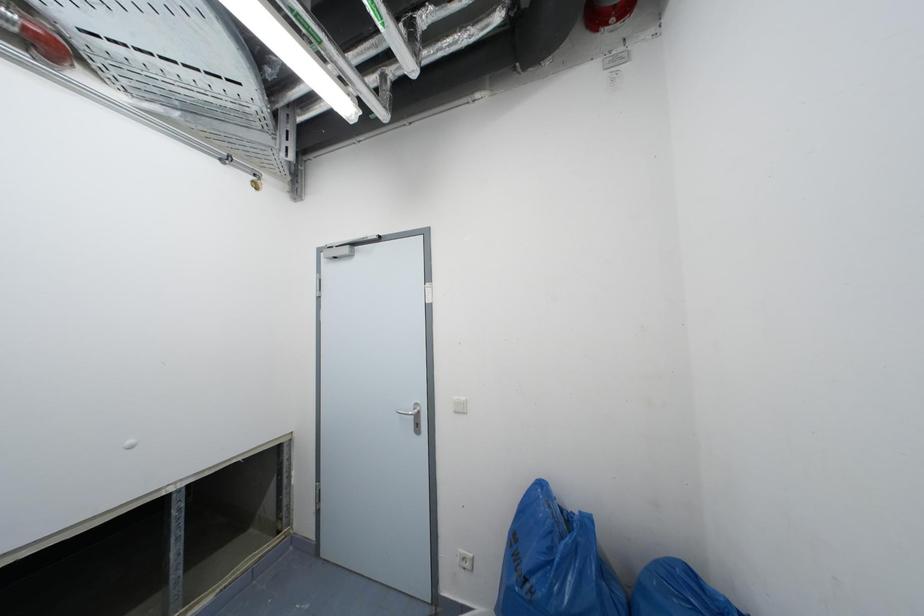
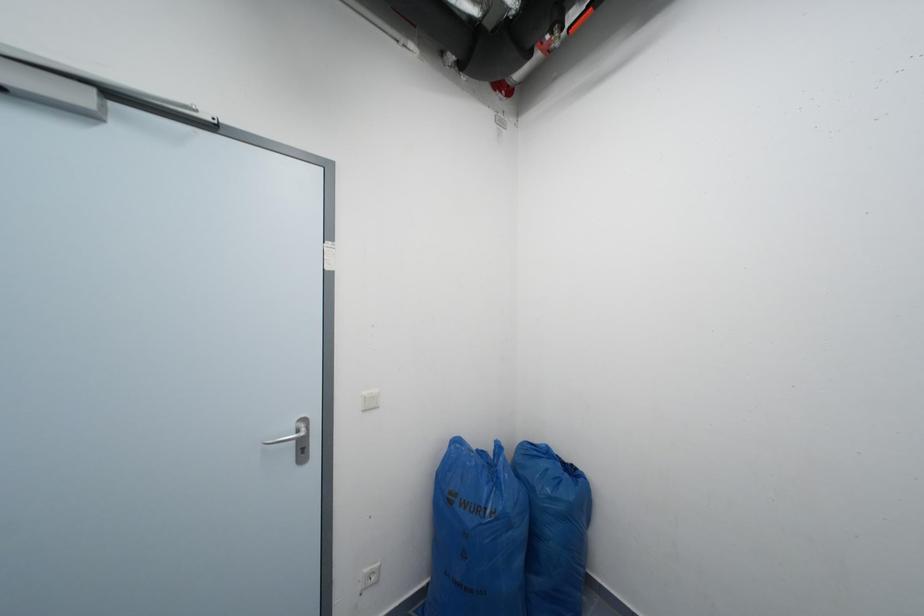
Question: The camera is either moving clockwise (left) or counter-clockwise (right) around the object. The first image is from the beginning of the video and the second image is from the end. Is the camera moving left or right when shooting the video?

Choices:
 (A) Left
 (B) Right

Answer: (A)